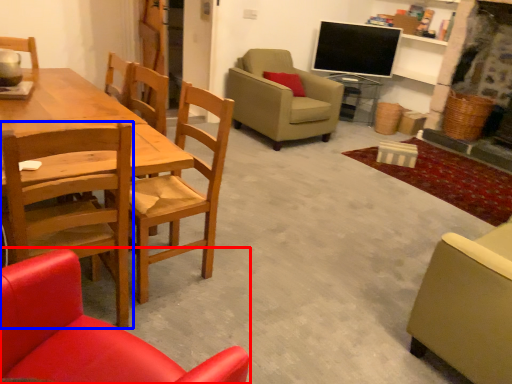
Question: Which point is closer to the camera, chair (highlighted by a red box) or chair (highlighted by a blue box)?

Choices:
 (A) chair
 (B) chair

Answer: (A)